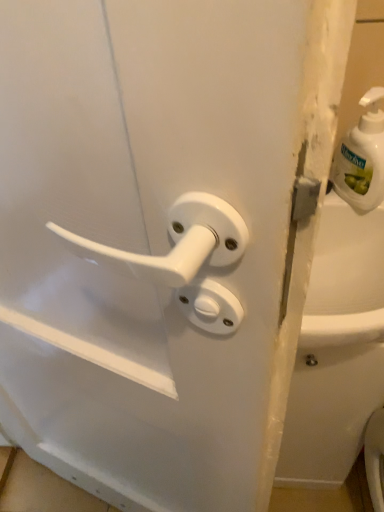
This screenshot has height=512, width=384. What do you see at coordinates (337, 349) in the screenshot? I see `white glossy bathtub at right` at bounding box center [337, 349].

Locate an element on the screen. This screenshot has height=512, width=384. white glossy bathtub at right is located at coordinates (337, 349).

Based on the photo, in order to face white glossy bathtub at right, should I rotate leftwards or rightwards?

It's best to rotate right around 17.313 degrees.

What is the approximate width of white glossy bathtub at right?

white glossy bathtub at right is 9.56 inches wide.

Measure the distance between point (302, 329) and camera.

Point (302, 329) and camera are 17.48 inches apart.

What is the approximate height of white plastic soap dispenser at upper right?

It is 18.91 centimeters.

Where is `white plastic soap dispenser at upper right`? white plastic soap dispenser at upper right is located at coordinates (362, 157).

The height and width of the screenshot is (512, 384). What do you see at coordinates (362, 157) in the screenshot?
I see `white plastic soap dispenser at upper right` at bounding box center [362, 157].

In order to face white plastic soap dispenser at upper right, should I rotate leftwards or rightwards?

Rotate your view right by about 21.925°.

Identify the location of white glossy bathtub at right. This screenshot has width=384, height=512. pyautogui.click(x=337, y=349).

From the picture: Between white glossy bathtub at right and white plastic soap dispenser at upper right, which one appears on the left side from the viewer's perspective?

Positioned to the left is white plastic soap dispenser at upper right.

Is white glossy bathtub at right positioned in front of white plastic soap dispenser at upper right?

That is False.

Which is in front, point (375, 397) or point (363, 196)?

The point (363, 196) is closer.

From the image's perspective, is white glossy bathtub at right located above or below white plastic soap dispenser at upper right?

Clearly, from the image's perspective, white glossy bathtub at right is below white plastic soap dispenser at upper right.

From a real-world perspective, is white glossy bathtub at right positioned above or below white plastic soap dispenser at upper right?

From a real-world perspective, white glossy bathtub at right is physically below white plastic soap dispenser at upper right.

Can you confirm if white glossy bathtub at right is thinner than white plastic soap dispenser at upper right?

No, white glossy bathtub at right is not thinner than white plastic soap dispenser at upper right.

Can you confirm if white glossy bathtub at right is taller than white plastic soap dispenser at upper right?

Indeed, white glossy bathtub at right has a greater height compared to white plastic soap dispenser at upper right.

Considering the relative sizes of white glossy bathtub at right and white plastic soap dispenser at upper right in the image provided, is white glossy bathtub at right smaller than white plastic soap dispenser at upper right?

Incorrect, white glossy bathtub at right is not smaller in size than white plastic soap dispenser at upper right.

Is white glossy bathtub at right located outside white plastic soap dispenser at upper right?

Absolutely, white glossy bathtub at right is external to white plastic soap dispenser at upper right.

Can you see white glossy bathtub at right touching white plastic soap dispenser at upper right?

No, white glossy bathtub at right is not with white plastic soap dispenser at upper right.

Is white glossy bathtub at right positioned with its back to white plastic soap dispenser at upper right?

That's not correct — white glossy bathtub at right is not looking away from white plastic soap dispenser at upper right.

Can you tell me how much white glossy bathtub at right and white plastic soap dispenser at upper right differ in facing direction?

The facing directions of white glossy bathtub at right and white plastic soap dispenser at upper right are 0.00199 degrees apart.

Locate an element on the screen. The image size is (384, 512). bath that is behind the white plastic soap dispenser at upper right is located at coordinates (337, 349).

Can you confirm if white plastic soap dispenser at upper right is positioned to the right of white glossy bathtub at right?

In fact, white plastic soap dispenser at upper right is to the left of white glossy bathtub at right.

Which is behind, white plastic soap dispenser at upper right or white glossy bathtub at right?

white glossy bathtub at right.

Is point (379, 167) closer to viewer compared to point (329, 260)?

That is True.

From the image's perspective, is white plastic soap dispenser at upper right beneath white glossy bathtub at right?

Actually, white plastic soap dispenser at upper right appears above white glossy bathtub at right in the image.

From a real-world perspective, is white plastic soap dispenser at upper right on white glossy bathtub at right?

Yes, from a real-world perspective, white plastic soap dispenser at upper right is over white glossy bathtub at right

Does white plastic soap dispenser at upper right have a greater width compared to white glossy bathtub at right?

No, white plastic soap dispenser at upper right is not wider than white glossy bathtub at right.

Which of these two, white plastic soap dispenser at upper right or white glossy bathtub at right, stands taller?

white glossy bathtub at right is taller.

Does white plastic soap dispenser at upper right have a larger size compared to white glossy bathtub at right?

No, white plastic soap dispenser at upper right is not bigger than white glossy bathtub at right.

Based on the photo, choose the correct answer: Is white plastic soap dispenser at upper right inside white glossy bathtub at right or outside it?

white plastic soap dispenser at upper right cannot be found inside white glossy bathtub at right.

Is white plastic soap dispenser at upper right not near white glossy bathtub at right?

No, white plastic soap dispenser at upper right is not far away from white glossy bathtub at right.

Does white plastic soap dispenser at upper right turn towards white glossy bathtub at right?

No, white plastic soap dispenser at upper right is not turned towards white glossy bathtub at right.

Locate an element on the screen. The height and width of the screenshot is (512, 384). bath below the white plastic soap dispenser at upper right (from a real-world perspective) is located at coordinates (337, 349).

At what (x,y) coordinates should I click in order to perform the action: click on bath beneath the white plastic soap dispenser at upper right (from a real-world perspective). Please return your answer as a coordinate pair (x, y). This screenshot has height=512, width=384. Looking at the image, I should click on (x=337, y=349).

Where is `bath located below the white plastic soap dispenser at upper right (from the image's perspective)`? This screenshot has width=384, height=512. bath located below the white plastic soap dispenser at upper right (from the image's perspective) is located at coordinates (337, 349).